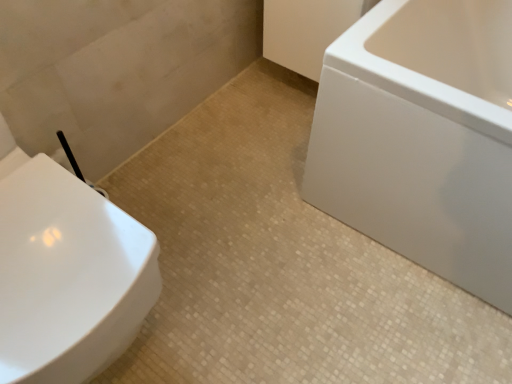
Where is `vacant space to the right of white glossy toilet at left`? Image resolution: width=512 pixels, height=384 pixels. vacant space to the right of white glossy toilet at left is located at coordinates (242, 281).